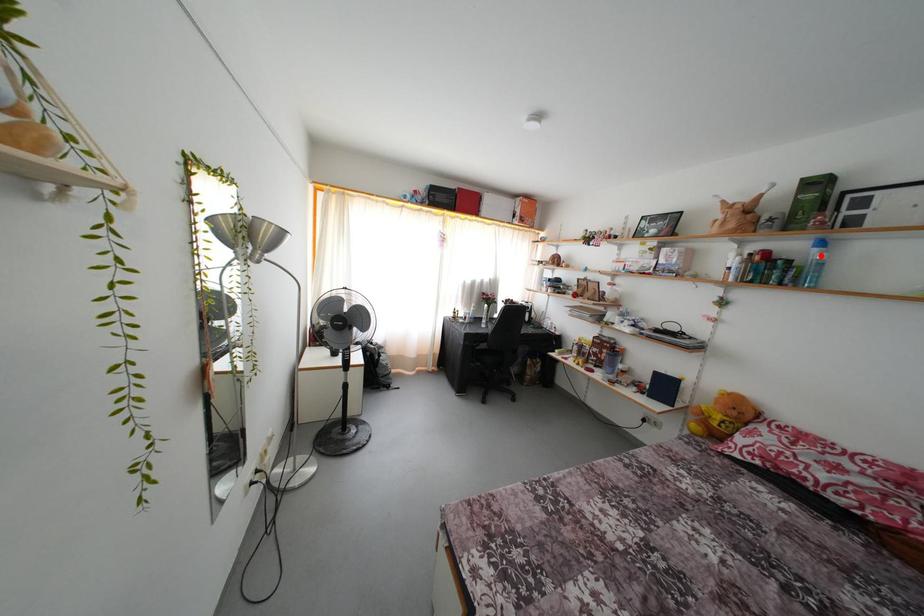
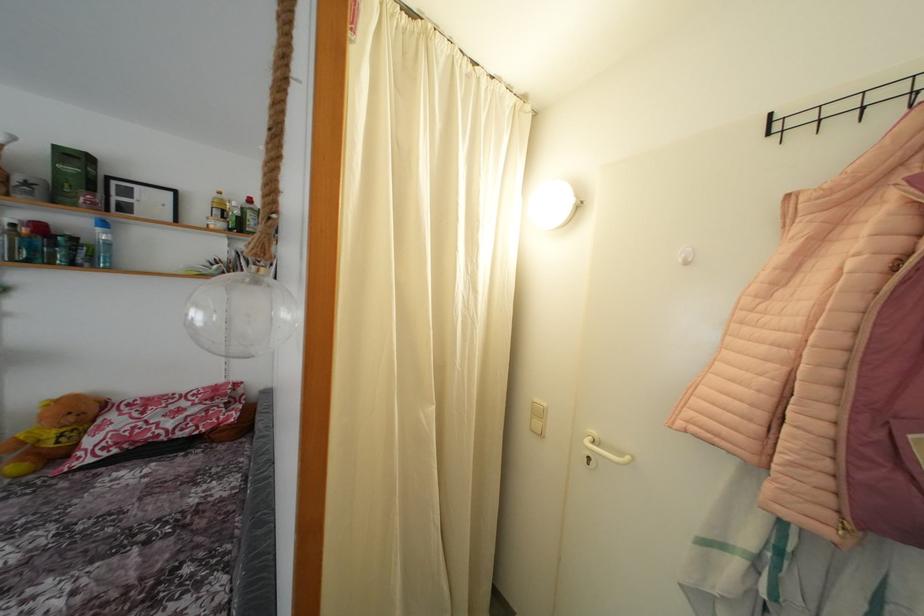
Where in the second image is the point corresponding to the highlighted location from the first image?

(104, 236)